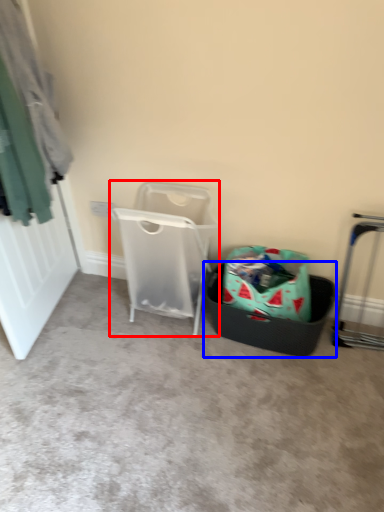
Question: Among these objects, which one is nearest to the camera, waste container (highlighted by a red box) or shopping basket (highlighted by a blue box)?

Choices:
 (A) waste container
 (B) shopping basket

Answer: (A)